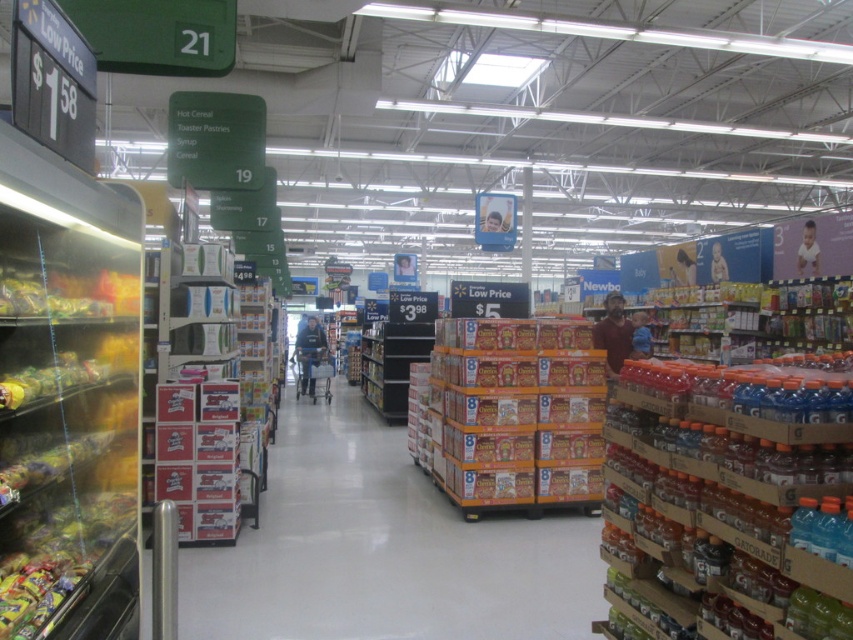
What is located at the coordinates point (67, 397) in the image?

At point (67, 397) is translucent plastic candy at left.